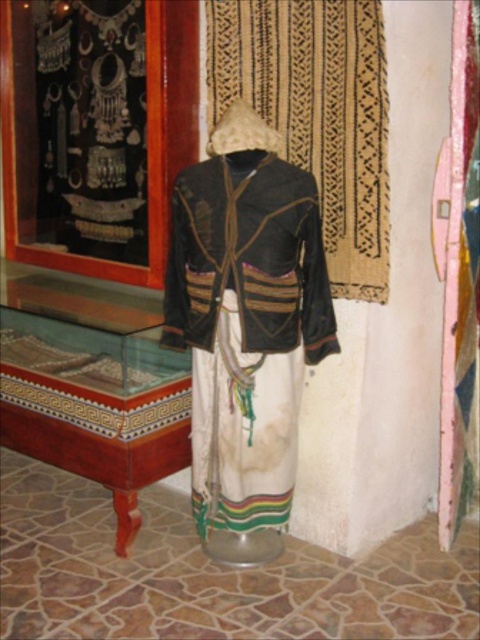
Question: Which of the following is the closest to the observer?

Choices:
 (A) natural woven fabric at upper center
 (B) dark brown textured jacket at center

Answer: (A)

Question: Does transparent glass table at lower left have a greater width compared to dark brown textured jacket at center?

Choices:
 (A) no
 (B) yes

Answer: (B)

Question: Does transparent glass table at lower left appear over natural woven fabric at upper center?

Choices:
 (A) no
 (B) yes

Answer: (A)

Question: Which of the following is the closest to the observer?

Choices:
 (A) (66, 352)
 (B) (348, 246)

Answer: (B)

Question: Observing the image, what is the correct spatial positioning of transparent glass table at lower left in reference to natural woven fabric at upper center?

Choices:
 (A) above
 (B) below

Answer: (B)

Question: Which point is closer to the camera taking this photo?

Choices:
 (A) (43, 332)
 (B) (302, 204)
 (C) (360, 166)

Answer: (B)